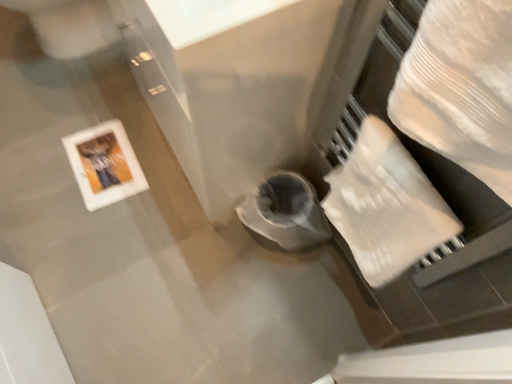
Question: From a real-world perspective, is white textured toilet paper at right positioned over white glossy picture frame at upper left based on gravity?

Choices:
 (A) yes
 (B) no

Answer: (A)

Question: Does white textured toilet paper at right appear on the left side of white glossy picture frame at upper left?

Choices:
 (A) yes
 (B) no

Answer: (B)

Question: Is the depth of white textured toilet paper at right greater than that of white glossy picture frame at upper left?

Choices:
 (A) yes
 (B) no

Answer: (B)

Question: Would you say white textured toilet paper at right is outside white glossy picture frame at upper left?

Choices:
 (A) no
 (B) yes

Answer: (B)

Question: Considering the relative sizes of white textured toilet paper at right and white glossy picture frame at upper left in the image provided, is white textured toilet paper at right shorter than white glossy picture frame at upper left?

Choices:
 (A) yes
 (B) no

Answer: (B)

Question: Considering the relative sizes of white textured toilet paper at right and white glossy picture frame at upper left in the image provided, is white textured toilet paper at right wider than white glossy picture frame at upper left?

Choices:
 (A) no
 (B) yes

Answer: (A)

Question: Is white glossy picture frame at upper left looking in the opposite direction of white textured toilet paper at right?

Choices:
 (A) yes
 (B) no

Answer: (B)

Question: Is there a large distance between white glossy picture frame at upper left and white textured toilet paper at right?

Choices:
 (A) no
 (B) yes

Answer: (A)

Question: Does white glossy picture frame at upper left have a smaller size compared to white textured toilet paper at right?

Choices:
 (A) yes
 (B) no

Answer: (A)

Question: Does white glossy picture frame at upper left turn towards white textured toilet paper at right?

Choices:
 (A) no
 (B) yes

Answer: (A)

Question: From the image's perspective, does white glossy picture frame at upper left appear higher than white textured toilet paper at right?

Choices:
 (A) no
 (B) yes

Answer: (B)

Question: Does white glossy picture frame at upper left have a lesser width compared to white textured toilet paper at right?

Choices:
 (A) yes
 (B) no

Answer: (B)

Question: From a real-world perspective, is white glossy picture frame at upper left physically located above or below white textured toilet paper at right?

Choices:
 (A) below
 (B) above

Answer: (A)